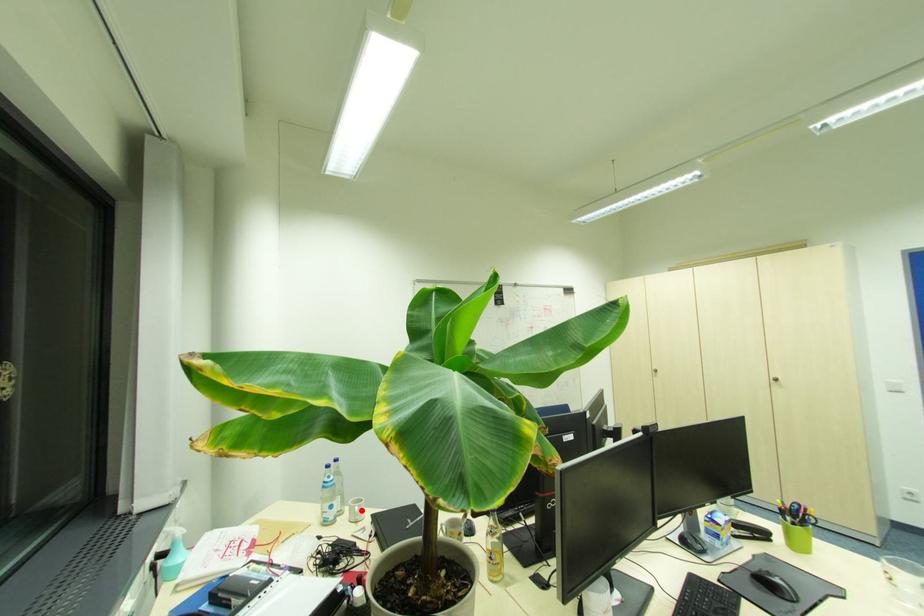
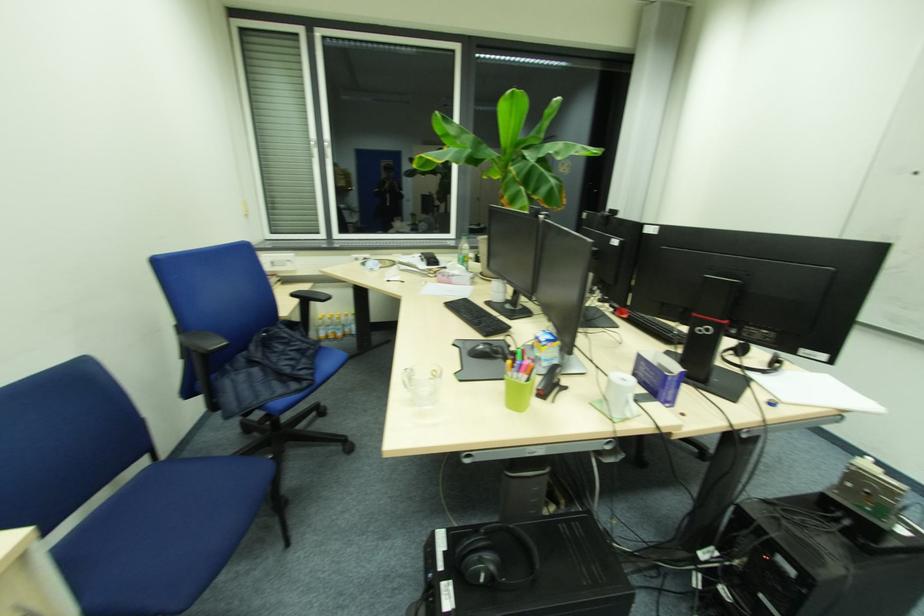
Question: I am providing you with two images of the same scene from different viewpoints. A red point is marked on the first image. Is the red point's position out of view in image 2?

Choices:
 (A) Yes
 (B) No

Answer: (A)